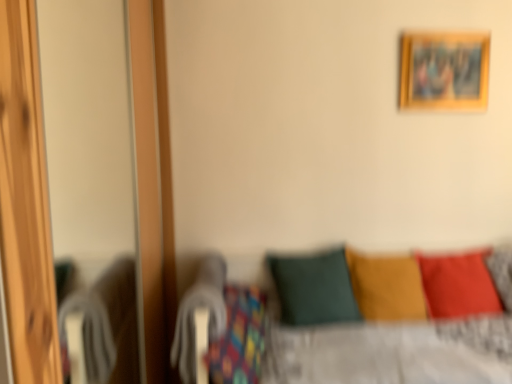
Question: Does wooden screen door at left appear on the left side of velvet yellow pillow at center, marked as the 2th pillow in a left-to-right arrangement?

Choices:
 (A) no
 (B) yes

Answer: (B)

Question: Is wooden screen door at left shorter than velvet yellow pillow at center, which is the second pillow in right-to-left order?

Choices:
 (A) no
 (B) yes

Answer: (A)

Question: Is there a large distance between wooden screen door at left and velvet yellow pillow at center, marked as the 2th pillow in a left-to-right arrangement?

Choices:
 (A) no
 (B) yes

Answer: (B)

Question: Is wooden screen door at left oriented towards velvet yellow pillow at center, marked as the 2th pillow in a left-to-right arrangement?

Choices:
 (A) yes
 (B) no

Answer: (A)

Question: Considering the relative sizes of wooden screen door at left and velvet yellow pillow at center, which is the second pillow in right-to-left order, in the image provided, is wooden screen door at left smaller than velvet yellow pillow at center, which is the second pillow in right-to-left order,?

Choices:
 (A) no
 (B) yes

Answer: (A)

Question: In the image, is wooden picture frame at upper right positioned in front of or behind dark green fabric pillow at center, placed as the 3th pillow when sorted from right to left?

Choices:
 (A) behind
 (B) front

Answer: (A)

Question: From a real-world perspective, is wooden picture frame at upper right above or below dark green fabric pillow at center, placed as the 3th pillow when sorted from right to left?

Choices:
 (A) below
 (B) above

Answer: (B)

Question: Do you think wooden picture frame at upper right is within dark green fabric pillow at center, placed as the 3th pillow when sorted from right to left, or outside of it?

Choices:
 (A) outside
 (B) inside

Answer: (A)

Question: Based on their positions, is wooden picture frame at upper right located to the left or right of dark green fabric pillow at center, placed as the 3th pillow when sorted from right to left?

Choices:
 (A) left
 (B) right

Answer: (B)

Question: In terms of width, does wooden picture frame at upper right look wider or thinner when compared to wooden screen door at left?

Choices:
 (A) thin
 (B) wide

Answer: (A)

Question: Considering the positions of wooden picture frame at upper right and wooden screen door at left in the image, is wooden picture frame at upper right taller or shorter than wooden screen door at left?

Choices:
 (A) tall
 (B) short

Answer: (B)

Question: In terms of size, does wooden picture frame at upper right appear bigger or smaller than wooden screen door at left?

Choices:
 (A) small
 (B) big

Answer: (A)

Question: Is wooden picture frame at upper right spatially inside wooden screen door at left, or outside of it?

Choices:
 (A) outside
 (B) inside

Answer: (A)

Question: Looking at their shapes, would you say matte red pillow at lower right, which appears as the 1th pillow when viewed from the right, is wider or thinner than dark green fabric pillow at center, marked as the 1th pillow in a left-to-right arrangement?

Choices:
 (A) wide
 (B) thin

Answer: (B)

Question: From a real-world perspective, is matte red pillow at lower right, which appears as the 1th pillow when viewed from the right, above or below dark green fabric pillow at center, marked as the 1th pillow in a left-to-right arrangement?

Choices:
 (A) above
 (B) below

Answer: (A)